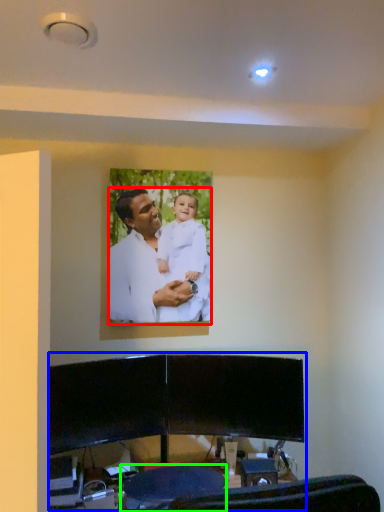
Question: Which is nearer to the man (highlighted by a red box)? entertainment center (highlighted by a blue box) or swivel chair (highlighted by a green box).

Choices:
 (A) entertainment center
 (B) swivel chair

Answer: (A)